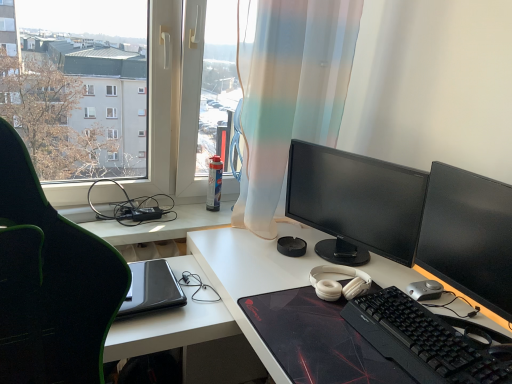
Identify the location of free space in front of silver metallic mouse at lower right. The height and width of the screenshot is (384, 512). (449, 311).